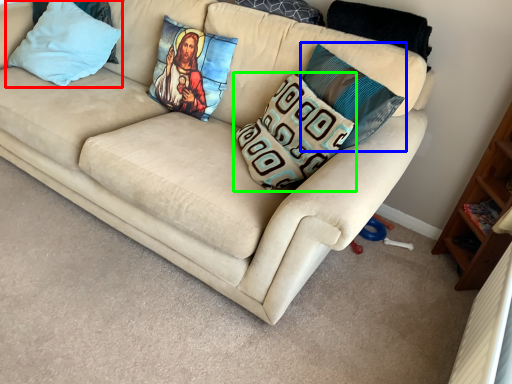
Question: Considering the real-world distances, which object is closest to pillow (highlighted by a red box)? pillow (highlighted by a blue box) or pillow (highlighted by a green box).

Choices:
 (A) pillow
 (B) pillow

Answer: (B)